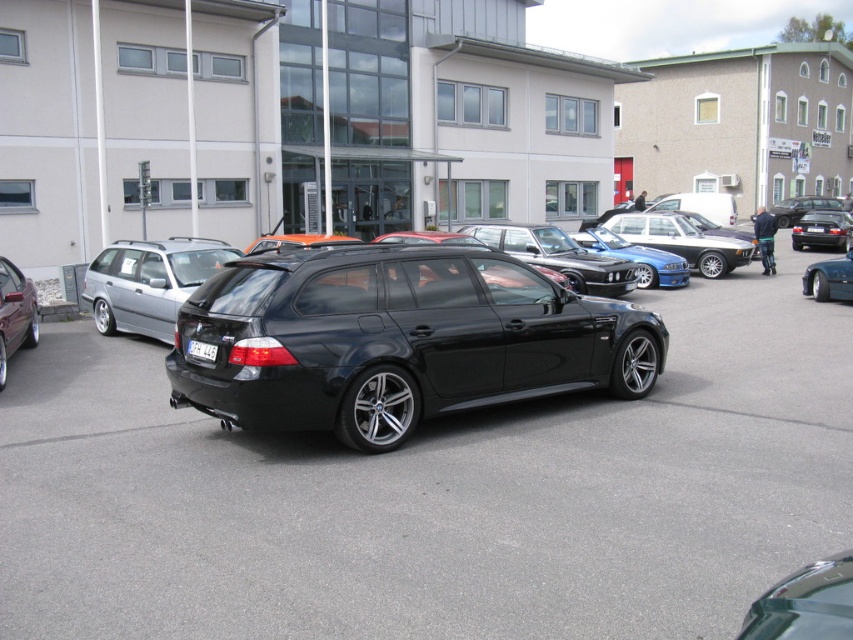
Question: Does black metallic sedan at right have a smaller size compared to white plastic license plate at center?

Choices:
 (A) yes
 (B) no

Answer: (B)

Question: Which point is farther to the camera?

Choices:
 (A) (3, 369)
 (B) (675, 236)

Answer: (B)

Question: Which of these objects is positioned closest to the shiny blue sedan at center?

Choices:
 (A) metallic blue sedan at right
 (B) silver metallic station wagon at left
 (C) black metallic sedan at right

Answer: (A)

Question: Which point is farther to the camera?

Choices:
 (A) silver metallic station wagon at left
 (B) black metallic car at center
 (C) black metallic sedan at right
 (D) transparent glass sedan at center

Answer: (C)

Question: Does black metallic sedan at center appear on the right side of glossy black sedan at center?

Choices:
 (A) yes
 (B) no

Answer: (B)

Question: Is silver metallic station wagon at left smaller than shiny metallic sedan at left?

Choices:
 (A) no
 (B) yes

Answer: (A)